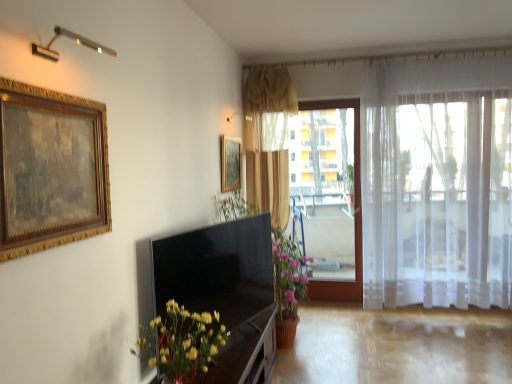
Question: Does matte gold curtain at center, which ranks as the 2th curtain in right-to-left order, have a lesser width compared to wooden dresser at lower center?

Choices:
 (A) yes
 (B) no

Answer: (A)

Question: From the image's perspective, is matte gold curtain at center, which is the first curtain in left-to-right order, on wooden dresser at lower center?

Choices:
 (A) no
 (B) yes

Answer: (B)

Question: Does matte gold curtain at center, which ranks as the 2th curtain in right-to-left order, have a greater width compared to wooden dresser at lower center?

Choices:
 (A) yes
 (B) no

Answer: (B)

Question: Is matte gold curtain at center, which is the first curtain in left-to-right order, taller than wooden dresser at lower center?

Choices:
 (A) no
 (B) yes

Answer: (B)

Question: Is the position of matte gold curtain at center, which ranks as the 2th curtain in right-to-left order, less distant than that of wooden dresser at lower center?

Choices:
 (A) no
 (B) yes

Answer: (A)

Question: Looking at their shapes, would you say gold wood picture frame at upper left, marked as the second picture frame in a right-to-left arrangement, is wider or thinner than transparent plastic window screen at center?

Choices:
 (A) wide
 (B) thin

Answer: (B)

Question: Is gold wood picture frame at upper left, the first picture frame from the front, in front of or behind transparent plastic window screen at center in the image?

Choices:
 (A) front
 (B) behind

Answer: (A)

Question: From the image's perspective, is gold wood picture frame at upper left, marked as the second picture frame in a right-to-left arrangement, above or below transparent plastic window screen at center?

Choices:
 (A) above
 (B) below

Answer: (A)

Question: Based on their positions, is gold wood picture frame at upper left, which is the second picture frame from back to front, located to the left or right of transparent plastic window screen at center?

Choices:
 (A) right
 (B) left

Answer: (B)

Question: Is matte gold curtain at center, which is the first curtain in left-to-right order, situated inside gold wood picture frame at upper left, marked as the second picture frame in a right-to-left arrangement, or outside?

Choices:
 (A) inside
 (B) outside

Answer: (B)

Question: From the image's perspective, is matte gold curtain at center, which is the first curtain in left-to-right order, above or below gold wood picture frame at upper left, the first picture frame from the front?

Choices:
 (A) below
 (B) above

Answer: (A)

Question: Relative to gold wood picture frame at upper left, marked as the second picture frame in a right-to-left arrangement, is matte gold curtain at center, which ranks as the 2th curtain in right-to-left order, in front or behind?

Choices:
 (A) front
 (B) behind

Answer: (B)

Question: Considering the positions of matte gold curtain at center, which is the first curtain in left-to-right order, and gold wood picture frame at upper left, which is the second picture frame from back to front, in the image, is matte gold curtain at center, which is the first curtain in left-to-right order, bigger or smaller than gold wood picture frame at upper left, which is the second picture frame from back to front,?

Choices:
 (A) small
 (B) big

Answer: (B)

Question: Is yellow matte vase at lower left taller or shorter than gold wood picture frame at upper left, the first picture frame from the front?

Choices:
 (A) tall
 (B) short

Answer: (B)

Question: Is point (189, 365) positioned closer to the camera than point (15, 190)?

Choices:
 (A) farther
 (B) closer

Answer: (A)